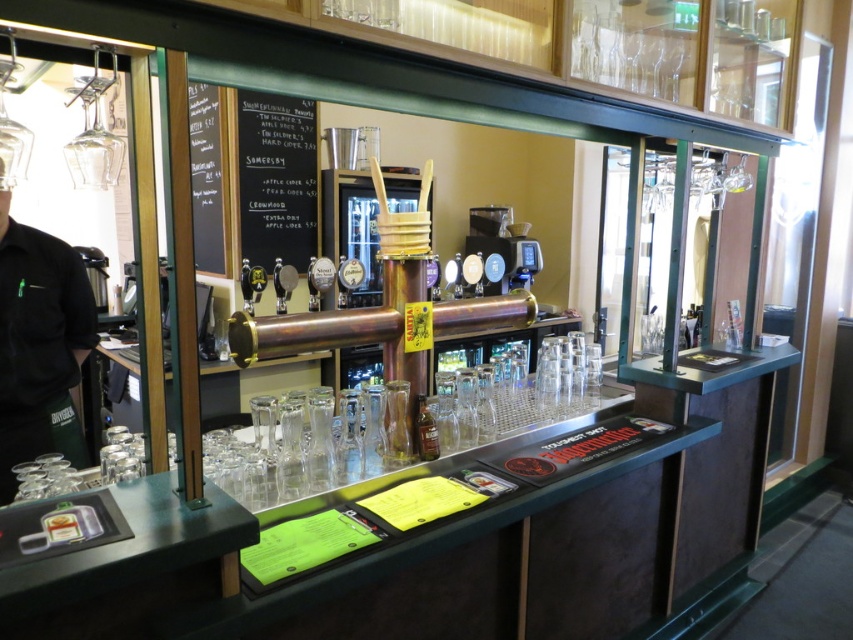
Question: Does black chalkboard at center have a greater width compared to clear glass bottle at center?

Choices:
 (A) yes
 (B) no

Answer: (A)

Question: Among these objects, which one is farthest from the camera?

Choices:
 (A) black plastic coffee machine at center
 (B) black chalkboard at center
 (C) black chalkboard at upper left

Answer: (A)

Question: Estimate the real-world distances between objects in this image. Which object is farther from the clear glass bottle at center?

Choices:
 (A) black plastic coffee machine at center
 (B) black fabric shirt at left
 (C) black chalkboard at upper left
 (D) black chalkboard at center

Answer: (A)

Question: Considering the relative positions of black chalkboard at center and black plastic coffee machine at center in the image provided, where is black chalkboard at center located with respect to black plastic coffee machine at center?

Choices:
 (A) left
 (B) right

Answer: (A)

Question: From the image, what is the correct spatial relationship of black plastic coffee machine at center in relation to clear glass bottle at center?

Choices:
 (A) above
 (B) below

Answer: (A)

Question: Which point is closer to the camera taking this photo?

Choices:
 (A) (419, 456)
 (B) (309, 120)

Answer: (A)